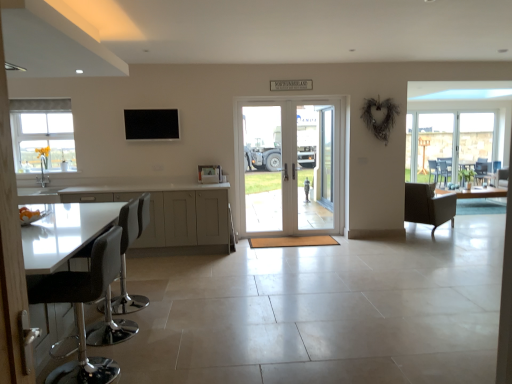
Question: Is there a large distance between white frosted glass window at upper left and clear glass door at center, the first screen door in the left-to-right sequence?

Choices:
 (A) no
 (B) yes

Answer: (B)

Question: From the image's perspective, does white frosted glass window at upper left appear lower than clear glass door at center, the first screen door in the left-to-right sequence?

Choices:
 (A) yes
 (B) no

Answer: (B)

Question: Is white frosted glass window at upper left thinner than clear glass door at center, which is the second screen door from right to left?

Choices:
 (A) no
 (B) yes

Answer: (A)

Question: Would you say white frosted glass window at upper left is outside clear glass door at center, which is the second screen door from right to left?

Choices:
 (A) no
 (B) yes

Answer: (B)

Question: Is white frosted glass window at upper left shorter than clear glass door at center, which is the second screen door from right to left?

Choices:
 (A) yes
 (B) no

Answer: (A)

Question: From a real-world perspective, is white frosted glass window at upper left over clear glass door at center, the first screen door in the left-to-right sequence?

Choices:
 (A) no
 (B) yes

Answer: (B)

Question: Is clear glass door at center, which is counted as the 2th screen door, starting from the left, a part of black matte tv at upper center?

Choices:
 (A) no
 (B) yes

Answer: (A)

Question: From the image's perspective, is black matte tv at upper center under clear glass door at center, arranged as the 1th screen door when viewed from the right?

Choices:
 (A) no
 (B) yes

Answer: (A)

Question: Are black matte tv at upper center and clear glass door at center, which is counted as the 2th screen door, starting from the left, located far from each other?

Choices:
 (A) no
 (B) yes

Answer: (B)

Question: Can you confirm if black matte tv at upper center is smaller than clear glass door at center, arranged as the 1th screen door when viewed from the right?

Choices:
 (A) no
 (B) yes

Answer: (B)

Question: Is black matte tv at upper center positioned beyond the bounds of clear glass door at center, arranged as the 1th screen door when viewed from the right?

Choices:
 (A) no
 (B) yes

Answer: (B)

Question: Considering the relative sizes of black matte tv at upper center and clear glass door at center, arranged as the 1th screen door when viewed from the right, in the image provided, is black matte tv at upper center bigger than clear glass door at center, arranged as the 1th screen door when viewed from the right,?

Choices:
 (A) yes
 (B) no

Answer: (B)

Question: Can you confirm if white glossy cabinets at lower left is thinner than white glossy door at center?

Choices:
 (A) no
 (B) yes

Answer: (A)